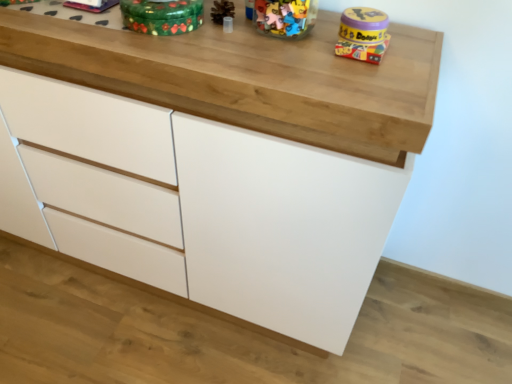
Question: From a real-world perspective, is green painted wood toy at upper center, acting as the 2th toy starting from the right, physically below matte yellow plastic toy at upper right, the first toy when ordered from right to left?

Choices:
 (A) no
 (B) yes

Answer: (A)

Question: Could you tell me if green painted wood toy at upper center, acting as the 2th toy starting from the right, is facing matte yellow plastic toy at upper right, arranged as the 2th toy when viewed from the left?

Choices:
 (A) yes
 (B) no

Answer: (B)

Question: Does green painted wood toy at upper center, acting as the 2th toy starting from the right, have a larger size compared to matte yellow plastic toy at upper right, arranged as the 2th toy when viewed from the left?

Choices:
 (A) yes
 (B) no

Answer: (A)

Question: Can you confirm if green painted wood toy at upper center, which ranks as the first toy in left-to-right order, is wider than matte yellow plastic toy at upper right, the first toy when ordered from right to left?

Choices:
 (A) no
 (B) yes

Answer: (B)

Question: Is green painted wood toy at upper center, which ranks as the first toy in left-to-right order, at the right side of matte yellow plastic toy at upper right, the first toy when ordered from right to left?

Choices:
 (A) yes
 (B) no

Answer: (B)

Question: Is matte yellow plastic toy at upper right, arranged as the 2th toy when viewed from the left, completely or partially inside green painted wood toy at upper center, acting as the 2th toy starting from the right?

Choices:
 (A) yes
 (B) no

Answer: (B)

Question: Considering the relative sizes of matte yellow plastic toy at upper right, the first toy when ordered from right to left, and green painted wood toy at upper center, which ranks as the first toy in left-to-right order, in the image provided, is matte yellow plastic toy at upper right, the first toy when ordered from right to left, thinner than green painted wood toy at upper center, which ranks as the first toy in left-to-right order,?

Choices:
 (A) no
 (B) yes

Answer: (B)

Question: Can you confirm if matte yellow plastic toy at upper right, the first toy when ordered from right to left, is smaller than green painted wood toy at upper center, acting as the 2th toy starting from the right?

Choices:
 (A) yes
 (B) no

Answer: (A)

Question: Is matte yellow plastic toy at upper right, the first toy when ordered from right to left, placed right next to green painted wood toy at upper center, which ranks as the first toy in left-to-right order?

Choices:
 (A) yes
 (B) no

Answer: (B)

Question: From the image's perspective, does matte yellow plastic toy at upper right, arranged as the 2th toy when viewed from the left, appear lower than green painted wood toy at upper center, which ranks as the first toy in left-to-right order?

Choices:
 (A) no
 (B) yes

Answer: (B)

Question: Can you confirm if matte yellow plastic toy at upper right, arranged as the 2th toy when viewed from the left, is positioned to the right of green painted wood toy at upper center, acting as the 2th toy starting from the right?

Choices:
 (A) no
 (B) yes

Answer: (B)

Question: Are matte yellow plastic toy at upper right, arranged as the 2th toy when viewed from the left, and green painted wood toy at upper center, which ranks as the first toy in left-to-right order, located far from each other?

Choices:
 (A) yes
 (B) no

Answer: (B)

Question: In the image, is green painted wood toy at upper center, acting as the 2th toy starting from the right, on the left side or the right side of matte yellow plastic toy at upper right, the first toy when ordered from right to left?

Choices:
 (A) right
 (B) left

Answer: (B)